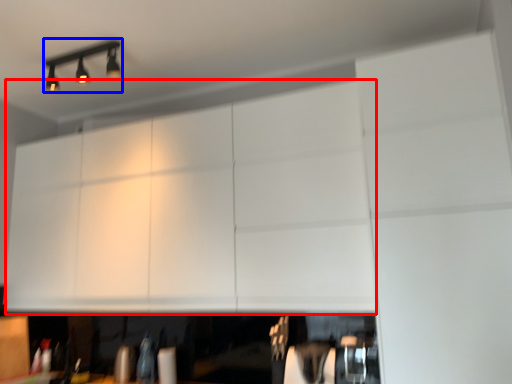
Question: Which of the following is the closest to the observer, cabinetry (highlighted by a red box) or lamp (highlighted by a blue box)?

Choices:
 (A) cabinetry
 (B) lamp

Answer: (A)